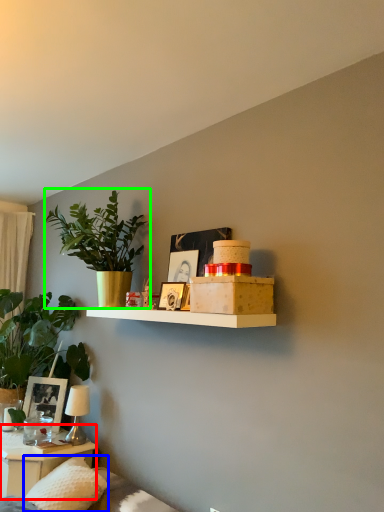
Question: Based on their relative distances, which object is nearer to table (highlighted by a red box)? Choose from pillow (highlighted by a blue box) and houseplant (highlighted by a green box).

Choices:
 (A) pillow
 (B) houseplant

Answer: (A)